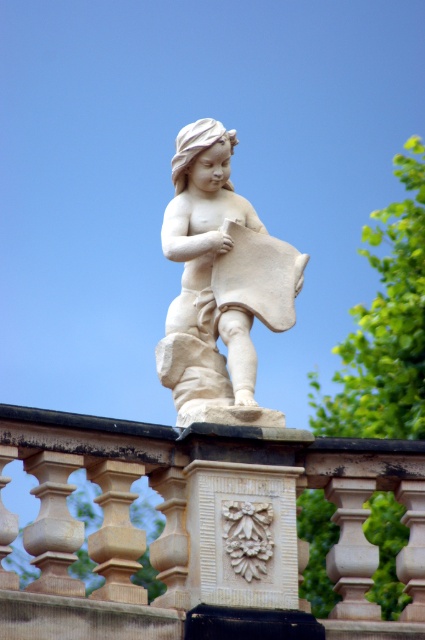
Question: From the image, what is the correct spatial relationship of white stone balustrade at center in relation to white marble statue at center?

Choices:
 (A) right
 (B) left

Answer: (A)

Question: Can you confirm if white stone balustrade at center is positioned above white marble statue at center?

Choices:
 (A) no
 (B) yes

Answer: (A)

Question: Is white stone balustrade at center thinner than white marble statue at center?

Choices:
 (A) yes
 (B) no

Answer: (B)

Question: Which point appears farthest from the camera in this image?

Choices:
 (A) (201, 541)
 (B) (275, 321)

Answer: (B)